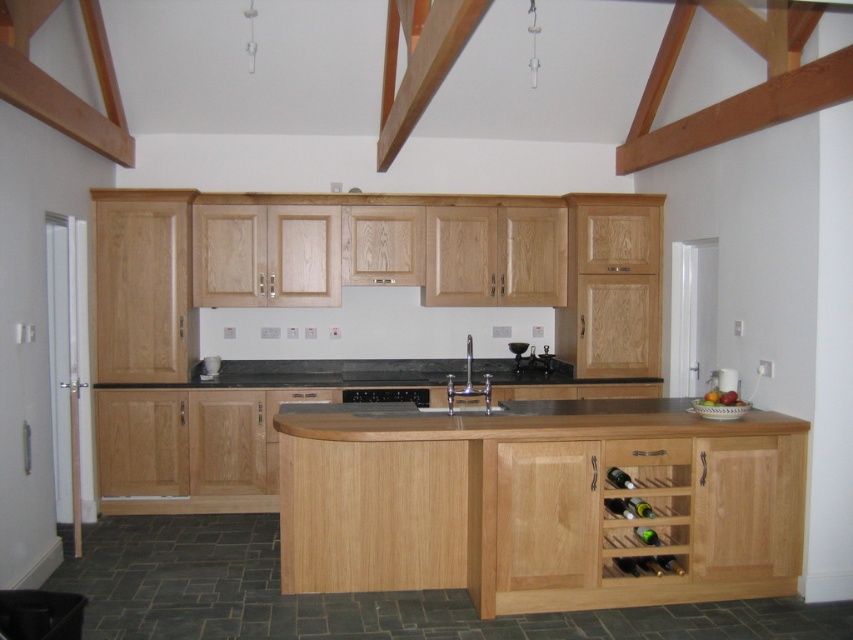
Between green glass wine bottle at lower center and green glass wine bottle at lower right, which one appears on the left side from the viewer's perspective?

green glass wine bottle at lower center is more to the left.

Who is lower down, green glass wine bottle at lower center or green glass wine bottle at lower right?

green glass wine bottle at lower right

Between point (625, 509) and point (651, 531), which one is positioned in front?

Point (625, 509) is in front.

Where is `green glass wine bottle at lower center`? green glass wine bottle at lower center is located at coordinates (619, 508).

Is point (468, 412) positioned before point (453, 404)?

Yes.

Is natural wood countertop at center wider than satin nickel faucet at center?

Yes.

What do you see at coordinates (521, 420) in the screenshot? I see `natural wood countertop at center` at bounding box center [521, 420].

Identify the location of natural wood countertop at center. (521, 420).

Is natural wood countertop at center taller than wooden wine rack at lower right?

No.

Who is taller, natural wood countertop at center or wooden wine rack at lower right?

wooden wine rack at lower right

Is point (508, 429) positioned behind point (648, 564)?

No, it is in front of (648, 564).

I want to click on natural wood countertop at center, so click(521, 420).